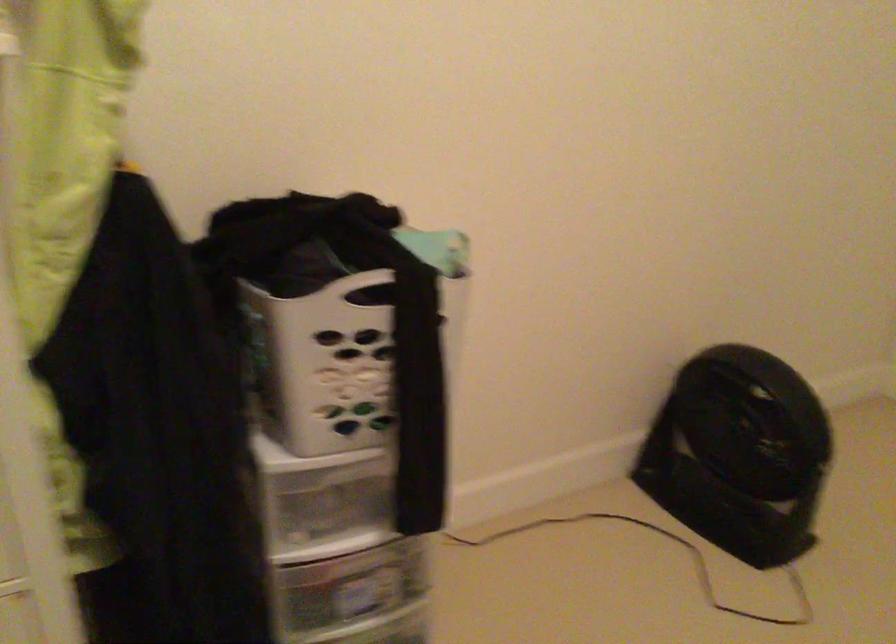
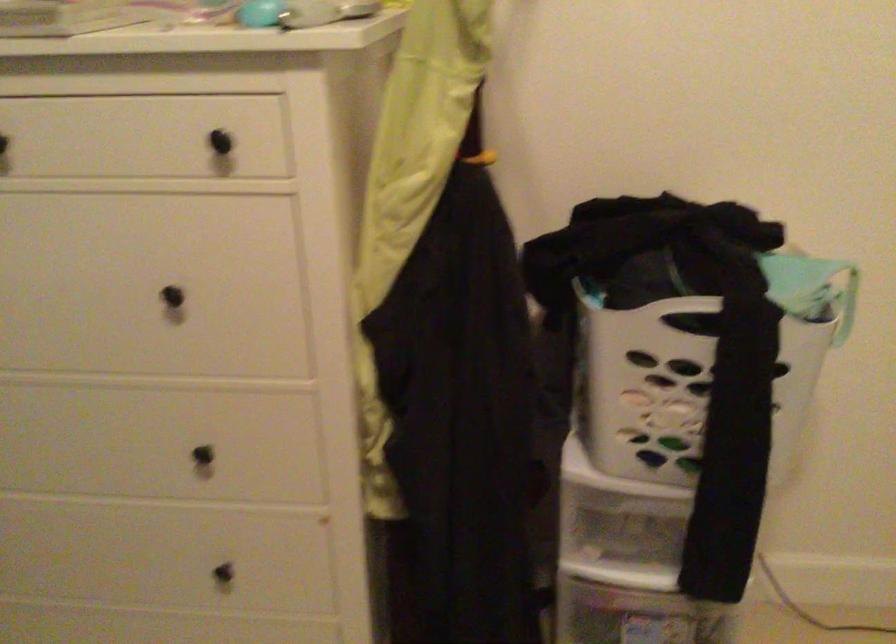
In the second image, find the point that corresponds to point (442, 231) in the first image.

(825, 261)